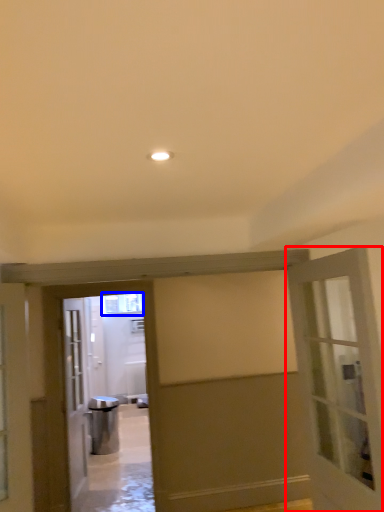
Question: Which point is further to the camera, door (highlighted by a red box) or window (highlighted by a blue box)?

Choices:
 (A) door
 (B) window

Answer: (B)